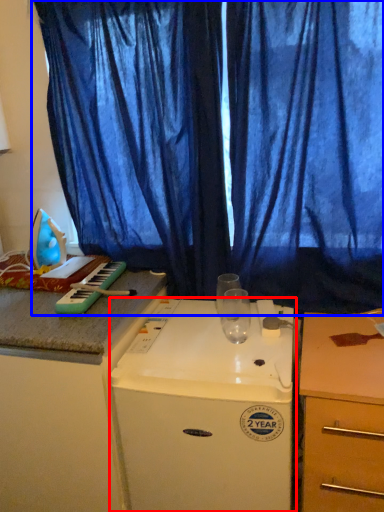
Question: Among these objects, which one is nearest to the camera, home appliance (highlighted by a red box) or curtain (highlighted by a blue box)?

Choices:
 (A) home appliance
 (B) curtain

Answer: (A)